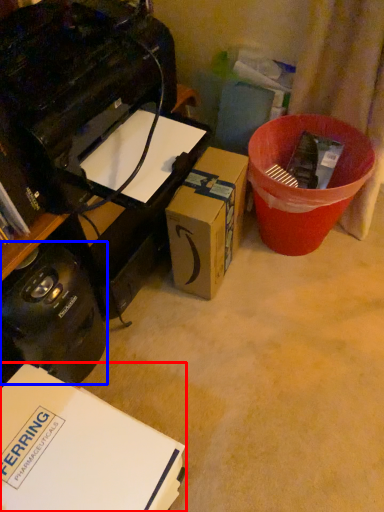
Question: Which of the following is the farthest to the observer, box (highlighted by a red box) or appliance (highlighted by a blue box)?

Choices:
 (A) box
 (B) appliance

Answer: (B)